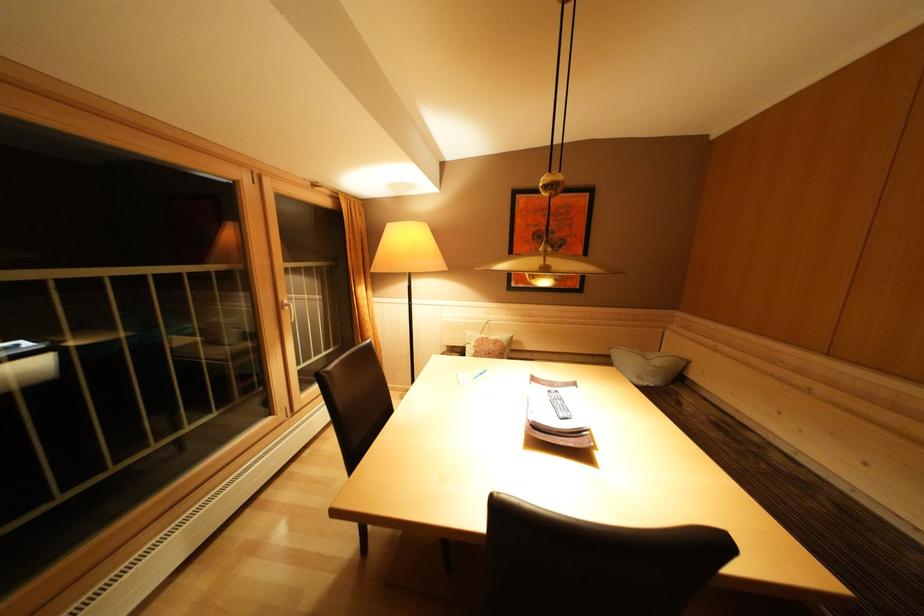
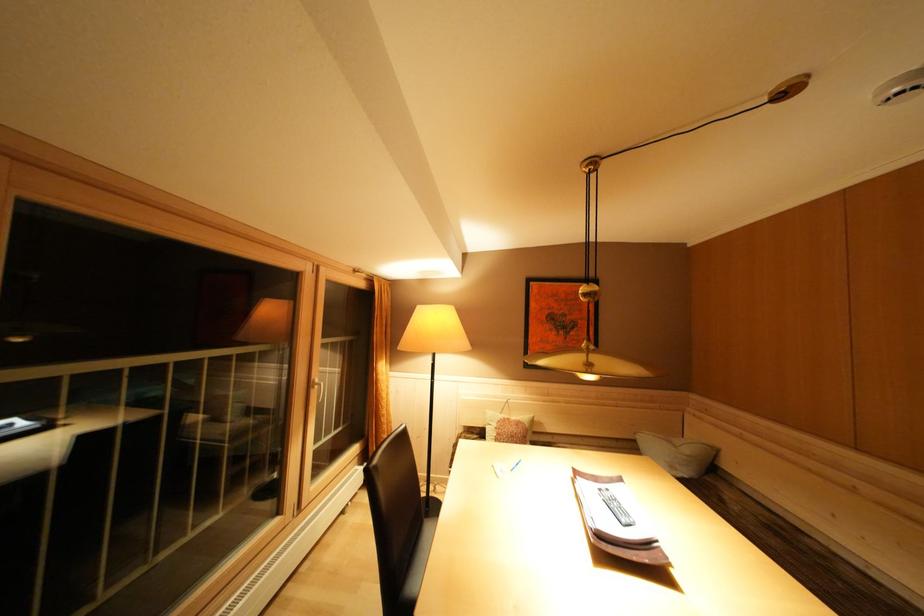
In the second image, find the point that corresponds to the point at 293,307 in the first image.

(323, 386)